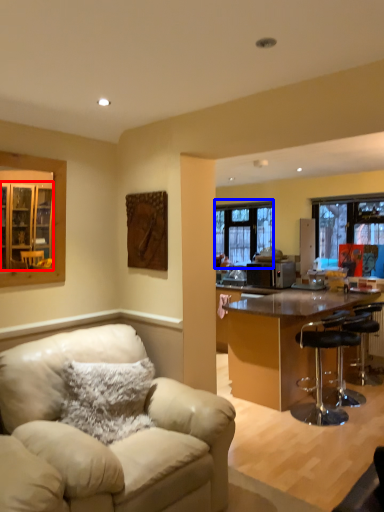
Question: Which object appears closest to the camera in this image, cabinetry (highlighted by a red box) or window (highlighted by a blue box)?

Choices:
 (A) cabinetry
 (B) window

Answer: (A)